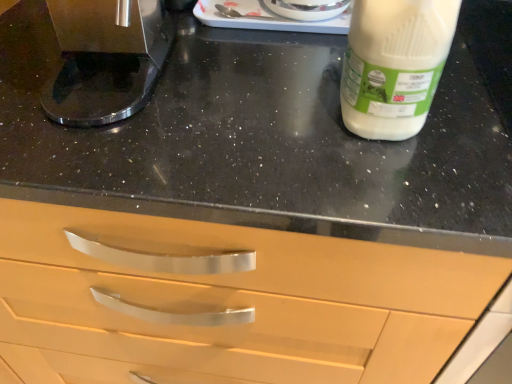
Find the location of a particular element. The height and width of the screenshot is (384, 512). vacant area that is in front of white plastic bottle at upper right is located at coordinates (393, 182).